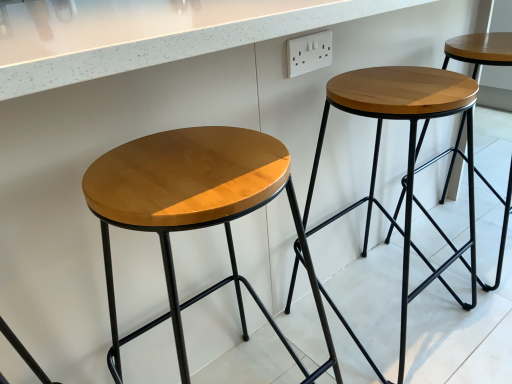
Question: Is matte wood stool at center, which is the second stool in right-to-left order, positioned with its back to white plastic outlet at upper center?

Choices:
 (A) no
 (B) yes

Answer: (A)

Question: Does matte wood stool at center, which is the second stool in right-to-left order, appear on the left side of white plastic outlet at upper center?

Choices:
 (A) yes
 (B) no

Answer: (A)

Question: Is matte wood stool at center, which is counted as the first stool, starting from the left, closer to the viewer compared to white plastic outlet at upper center?

Choices:
 (A) no
 (B) yes

Answer: (B)

Question: Considering the relative positions of matte wood stool at center, which is the second stool in right-to-left order, and white plastic outlet at upper center in the image provided, is matte wood stool at center, which is the second stool in right-to-left order, behind white plastic outlet at upper center?

Choices:
 (A) no
 (B) yes

Answer: (A)

Question: From the image's perspective, is matte wood stool at center, which is counted as the first stool, starting from the left, located beneath white plastic outlet at upper center?

Choices:
 (A) yes
 (B) no

Answer: (A)

Question: In terms of height, does matte wood stool at center, which is counted as the first stool, starting from the left, look taller or shorter compared to wooden stool at center, placed as the first stool when sorted from right to left?

Choices:
 (A) tall
 (B) short

Answer: (A)

Question: Considering the positions of matte wood stool at center, which is the second stool in right-to-left order, and wooden stool at center, the second stool when ordered from left to right, in the image, is matte wood stool at center, which is the second stool in right-to-left order, bigger or smaller than wooden stool at center, the second stool when ordered from left to right,?

Choices:
 (A) small
 (B) big

Answer: (A)

Question: From a real-world perspective, relative to wooden stool at center, the second stool when ordered from left to right, is matte wood stool at center, which is counted as the first stool, starting from the left, vertically above or below?

Choices:
 (A) below
 (B) above

Answer: (B)

Question: Choose the correct answer: Is matte wood stool at center, which is the second stool in right-to-left order, inside wooden stool at center, placed as the first stool when sorted from right to left, or outside it?

Choices:
 (A) outside
 (B) inside

Answer: (A)

Question: Relative to matte wood stool at center, which is counted as the first stool, starting from the left, is wooden stool at center, placed as the first stool when sorted from right to left, in front or behind?

Choices:
 (A) front
 (B) behind

Answer: (B)

Question: From the image's perspective, relative to matte wood stool at center, which is the second stool in right-to-left order, is wooden stool at center, the second stool when ordered from left to right, above or below?

Choices:
 (A) above
 (B) below

Answer: (A)

Question: In terms of height, does wooden stool at center, placed as the first stool when sorted from right to left, look taller or shorter compared to matte wood stool at center, which is the second stool in right-to-left order?

Choices:
 (A) short
 (B) tall

Answer: (A)

Question: Based on their positions, is wooden stool at center, the second stool when ordered from left to right, located to the left or right of matte wood stool at center, which is the second stool in right-to-left order?

Choices:
 (A) left
 (B) right

Answer: (B)

Question: In the image, is white plastic outlet at upper center positioned in front of or behind wooden stool at center, the second stool when ordered from left to right?

Choices:
 (A) front
 (B) behind

Answer: (B)

Question: From a real-world perspective, relative to wooden stool at center, placed as the first stool when sorted from right to left, is white plastic outlet at upper center vertically above or below?

Choices:
 (A) below
 (B) above

Answer: (B)